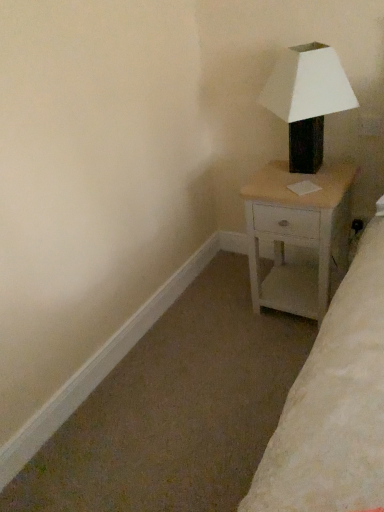
Question: Is matte black lamp at upper right thinner than white wood nightstand at right?

Choices:
 (A) yes
 (B) no

Answer: (A)

Question: Can we say matte black lamp at upper right lies outside white wood nightstand at right?

Choices:
 (A) no
 (B) yes

Answer: (B)

Question: From the image's perspective, is matte black lamp at upper right above white wood nightstand at right?

Choices:
 (A) no
 (B) yes

Answer: (B)

Question: Considering the relative sizes of matte black lamp at upper right and white wood nightstand at right in the image provided, is matte black lamp at upper right taller than white wood nightstand at right?

Choices:
 (A) no
 (B) yes

Answer: (A)

Question: Is matte black lamp at upper right behind white wood nightstand at right?

Choices:
 (A) yes
 (B) no

Answer: (B)

Question: Can you confirm if matte black lamp at upper right is positioned to the right of white wood nightstand at right?

Choices:
 (A) yes
 (B) no

Answer: (B)

Question: From a real-world perspective, is white wood nightstand at right physically below matte black lamp at upper right?

Choices:
 (A) no
 (B) yes

Answer: (B)

Question: Is white wood nightstand at right positioned beyond the bounds of matte black lamp at upper right?

Choices:
 (A) no
 (B) yes

Answer: (B)

Question: Is white wood nightstand at right far away from matte black lamp at upper right?

Choices:
 (A) yes
 (B) no

Answer: (B)

Question: From the image's perspective, is white wood nightstand at right located above matte black lamp at upper right?

Choices:
 (A) yes
 (B) no

Answer: (B)

Question: From a real-world perspective, does white wood nightstand at right stand above matte black lamp at upper right?

Choices:
 (A) no
 (B) yes

Answer: (A)

Question: Is white wood nightstand at right in front of matte black lamp at upper right?

Choices:
 (A) no
 (B) yes

Answer: (A)

Question: From a real-world perspective, relative to matte black lamp at upper right, is white wood nightstand at right vertically above or below?

Choices:
 (A) below
 (B) above

Answer: (A)